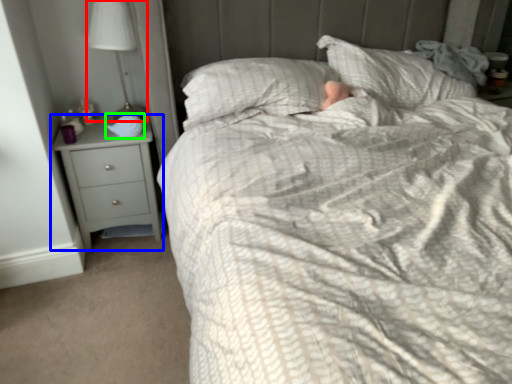
Question: Estimate the real-world distances between objects in this image. Which object is farther from lamp (highlighted by a red box), chest of drawers (highlighted by a blue box) or sleeping bag (highlighted by a green box)?

Choices:
 (A) chest of drawers
 (B) sleeping bag

Answer: (A)